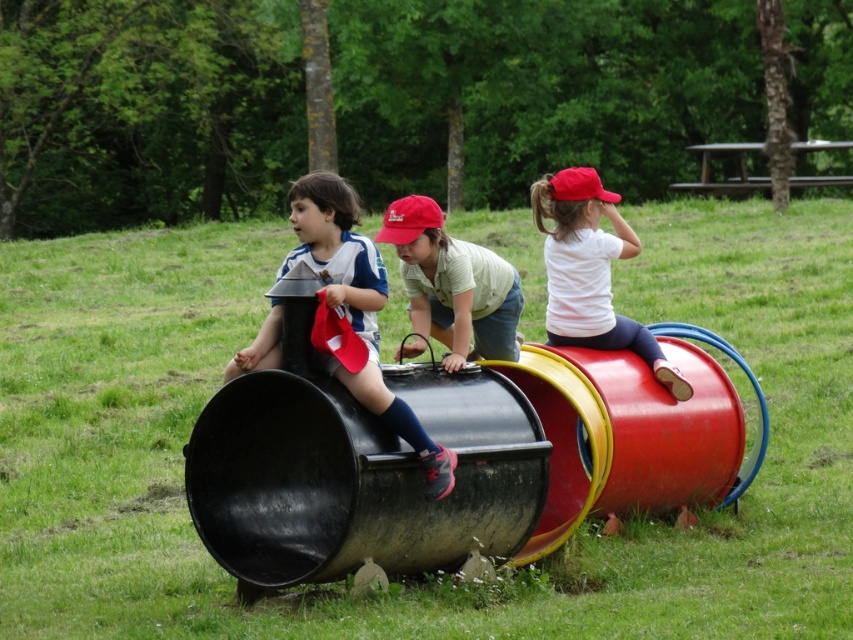
You are a parent supervising children at the playground. You notice two objects in the scene, the matte black pants at left and the matte red cap at center. Which object is shorter?

The matte black pants at left is not as tall as the matte red cap at center, so the matte black pants at left is shorter.

You are a photographer taking a picture of the playground scene. You notice the white matte shirt at upper right and the matte red cap at center. Which object should you focus on if you want to capture the taller one in your shot?

The white matte shirt at upper right is taller than the matte red cap at center, so you should focus on the white matte shirt at upper right to capture the taller one.

You are a photographer trying to capture a clear shot of both the white matte shirt at upper right and the matte red cap at center. Since you want to ensure both are visible, which object should you focus on first to account for their sizes?

The white matte shirt at upper right is larger in size than the matte red cap at center, so you should focus on the white matte shirt at upper right first to ensure it is clearly visible before adjusting for the smaller matte red cap at center.